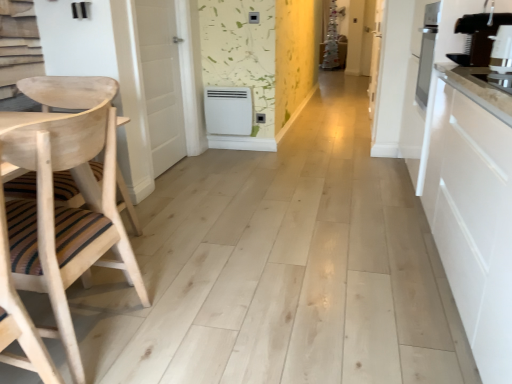
Question: Can you confirm if white smooth door at left, which appears as the 1th door when viewed from the front, is positioned to the right of white wood door at center, arranged as the second door when viewed from the front?

Choices:
 (A) no
 (B) yes

Answer: (A)

Question: Does white smooth door at left, which is the 2th door in right-to-left order, come behind white wood door at center, arranged as the second door when viewed from the front?

Choices:
 (A) yes
 (B) no

Answer: (B)

Question: Is white wood door at center, the second door positioned from the left, at the back of white smooth door at left, which is the 2th door in right-to-left order?

Choices:
 (A) yes
 (B) no

Answer: (B)

Question: Is there a large distance between white smooth door at left, which appears as the first door when viewed from the left, and white wood door at center, the second door positioned from the left?

Choices:
 (A) yes
 (B) no

Answer: (A)

Question: Does white smooth door at left, which is the 2th door in right-to-left order, have a greater width compared to white wood door at center, which is the first door in back-to-front order?

Choices:
 (A) yes
 (B) no

Answer: (A)

Question: From the image's perspective, is white smooth door at left, the 2th door viewed from the back, on top of white wood door at center, which is counted as the first door, starting from the right?

Choices:
 (A) yes
 (B) no

Answer: (B)

Question: Could you tell me if white smooth door at left, the 2th door viewed from the back, is turned towards black plastic coffee machine at right?

Choices:
 (A) yes
 (B) no

Answer: (A)

Question: Is the depth of white smooth door at left, which appears as the first door when viewed from the left, greater than that of black plastic coffee machine at right?

Choices:
 (A) yes
 (B) no

Answer: (A)

Question: Can you confirm if white smooth door at left, the 2th door viewed from the back, is taller than black plastic coffee machine at right?

Choices:
 (A) no
 (B) yes

Answer: (B)

Question: Considering the relative positions of white smooth door at left, the 2th door viewed from the back, and black plastic coffee machine at right in the image provided, is white smooth door at left, the 2th door viewed from the back, to the left of black plastic coffee machine at right from the viewer's perspective?

Choices:
 (A) yes
 (B) no

Answer: (A)

Question: Would you consider white smooth door at left, which appears as the 1th door when viewed from the front, to be distant from black plastic coffee machine at right?

Choices:
 (A) no
 (B) yes

Answer: (B)

Question: Considering the relative sizes of white smooth door at left, which is the 2th door in right-to-left order, and black plastic coffee machine at right in the image provided, is white smooth door at left, which is the 2th door in right-to-left order, wider than black plastic coffee machine at right?

Choices:
 (A) no
 (B) yes

Answer: (A)

Question: Can we say white wood door at center, arranged as the second door when viewed from the front, lies outside black plastic coffee machine at right?

Choices:
 (A) yes
 (B) no

Answer: (A)